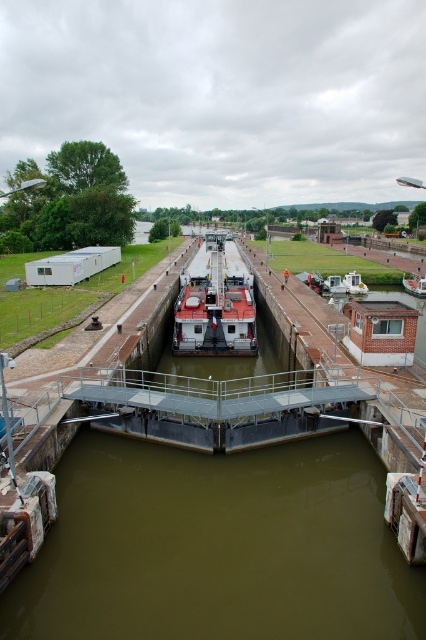
Does red matte boat at center have a lesser width compared to wooden boat at center?

No, red matte boat at center is not thinner than wooden boat at center.

From the picture: Who is positioned more to the left, red matte boat at center or wooden boat at center?

From the viewer's perspective, red matte boat at center appears more on the left side.

Which is behind, point (180, 330) or point (423, 282)?

Positioned behind is point (423, 282).

Find the location of a particular element. The image size is (426, 640). red matte boat at center is located at coordinates [x=215, y=301].

Can you confirm if wooden boat at center is bigger than white plastic boat at center?

Yes, wooden boat at center is bigger than white plastic boat at center.

Is wooden boat at center above white plastic boat at center?

Incorrect, wooden boat at center is not positioned above white plastic boat at center.

From the picture: Measure the distance between point (416, 292) and camera.

They are 54.60 meters apart.

Find the location of `wooden boat at center`. wooden boat at center is located at coordinates (414, 284).

Who is positioned more to the left, red matte boat at center or white plastic boat at center?

From the viewer's perspective, red matte boat at center appears more on the left side.

Between point (175, 305) and point (365, 289), which one is positioned in front?

Positioned in front is point (175, 305).

This screenshot has height=640, width=426. Identify the location of red matte boat at center. (215, 301).